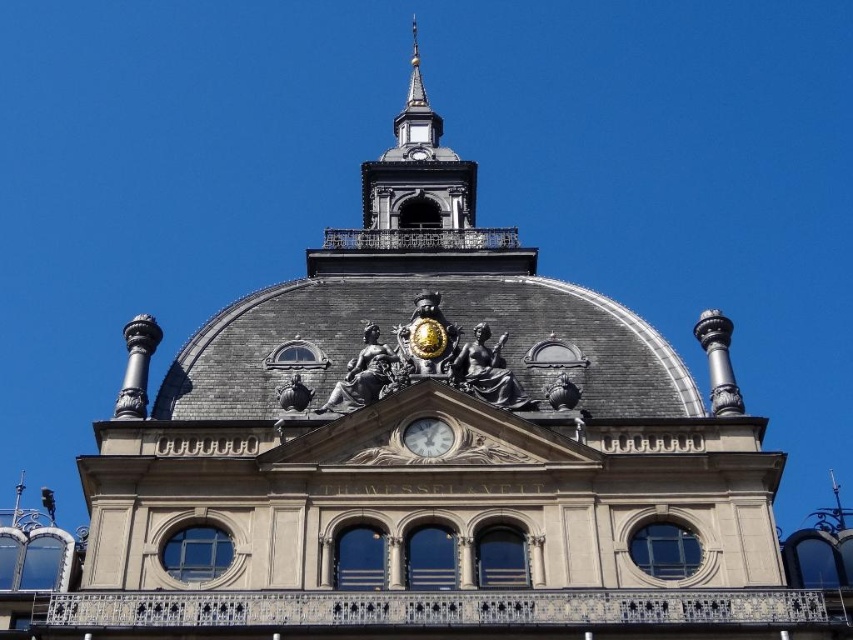
You are standing in front of the classical building and want to know which of the two points, point (386, 340) or point (281, 394), is closer to you. Can you determine this based on their positions?

Point (386, 340) is further to the camera than point (281, 394), so point (281, 394) is closer to you.

Based on the scene described, which object is positioned to the left when observing the central area of the building? Please consider the white glossy clock at center and the shiny bronze statue at center in your answer.

The white glossy clock at center is positioned to the left of the shiny bronze statue at center.